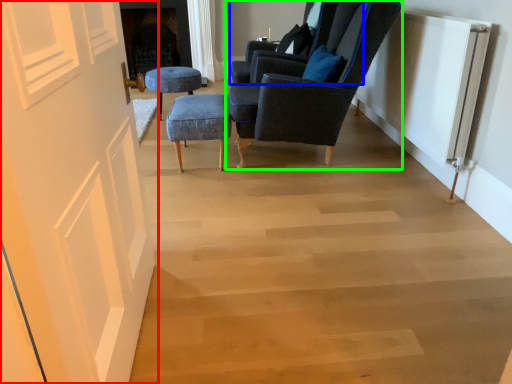
Question: Considering the real-world distances, which object is closest to door (highlighted by a red box)? chair (highlighted by a blue box) or chair (highlighted by a green box).

Choices:
 (A) chair
 (B) chair

Answer: (B)